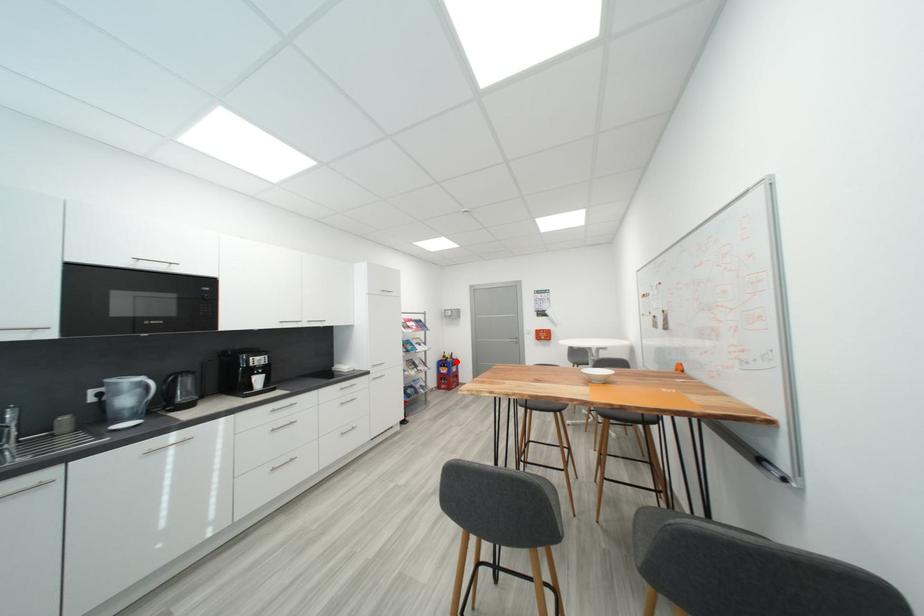
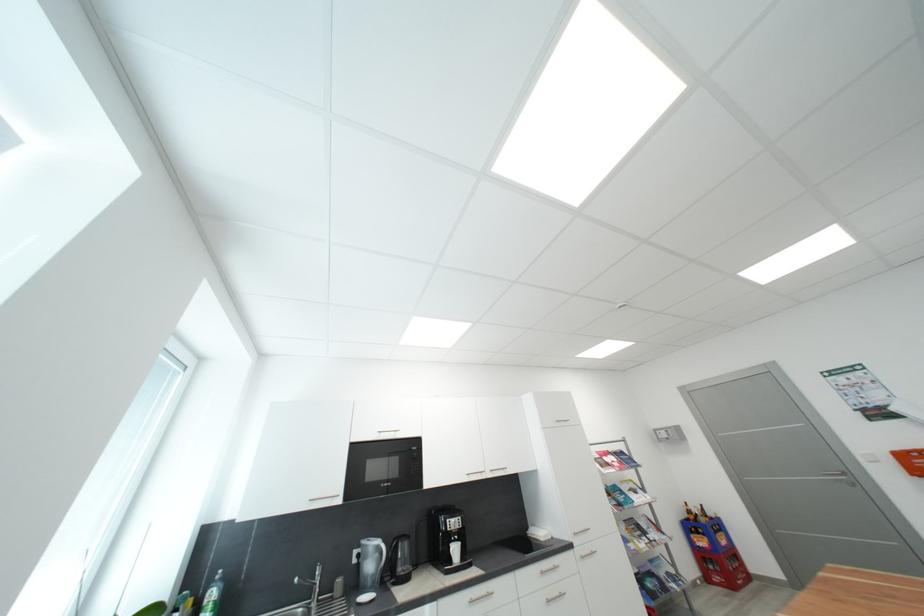
Find the pixel in the second image that matches the highlighted location in the first image.

(710, 522)